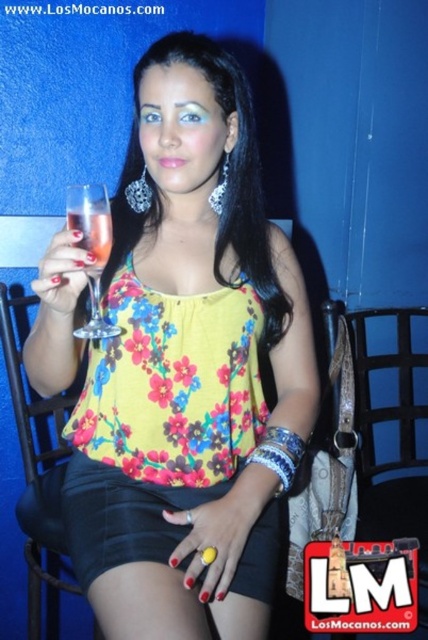
You are standing in a room with a woman seated against a blue wall. You see a matte glass at left. Where is the matte glass located in terms of coordinates?

The matte glass at left is located at coordinates point [61,280].

You are a bartender preparing drinks and need to choose between the matte glass at left and the clear glass at upper left for a cocktail. Which glass has a greater width?

The matte glass at left has a greater width than the clear glass at upper left according to the description.

You are an interior designer working on a project and need to place a decorative item exactly at the coordinates given by the client. The client mentioned the yellow matte ring at lower center is at point 0.844, 0.502. Can you confirm if this coordinate is within the lower half of the image?

The coordinate [214,540] for the yellow matte ring at lower center indicates that it is in the lower half of the image since the y value of 0.502 is just above the midpoint of the image.